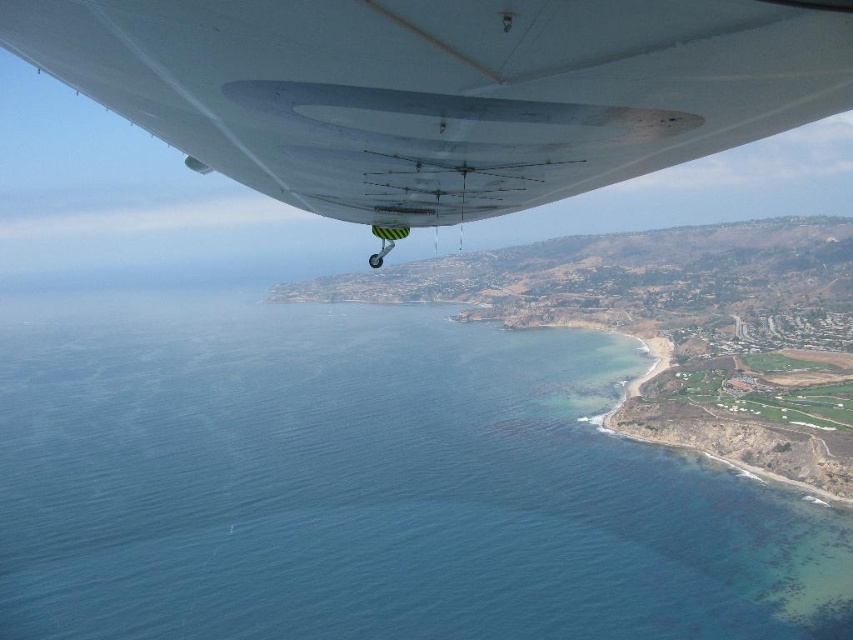
Question: Is blue water at lower left wider than white matte wing at upper center?

Choices:
 (A) yes
 (B) no

Answer: (A)

Question: Can you confirm if blue water at lower left is smaller than white matte wing at upper center?

Choices:
 (A) yes
 (B) no

Answer: (B)

Question: Can you confirm if blue water at lower left is bigger than white matte wing at upper center?

Choices:
 (A) no
 (B) yes

Answer: (B)

Question: Among these points, which one is farthest from the camera?

Choices:
 (A) (183, 323)
 (B) (572, 83)

Answer: (A)